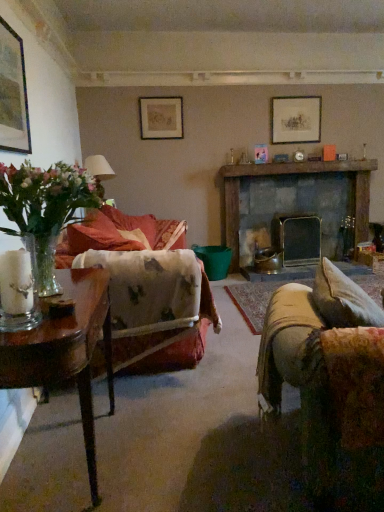
Question: Considering the relative sizes of clear glass vase at left and matte black picture frame at upper left, which is the third picture frame from back to front, in the image provided, is clear glass vase at left thinner than matte black picture frame at upper left, which is the third picture frame from back to front,?

Choices:
 (A) yes
 (B) no

Answer: (B)

Question: Can matte black picture frame at upper left, which is counted as the 3th picture frame, starting from the right, be found inside clear glass vase at left?

Choices:
 (A) no
 (B) yes

Answer: (A)

Question: From a real-world perspective, is clear glass vase at left on top of matte black picture frame at upper left, which is counted as the 3th picture frame, starting from the right?

Choices:
 (A) no
 (B) yes

Answer: (A)

Question: Can you confirm if clear glass vase at left is taller than matte black picture frame at upper left, which is counted as the 1th picture frame, starting from the front?

Choices:
 (A) no
 (B) yes

Answer: (A)

Question: Can you confirm if clear glass vase at left is shorter than matte black picture frame at upper left, which is counted as the 3th picture frame, starting from the right?

Choices:
 (A) no
 (B) yes

Answer: (B)

Question: Considering the relative positions of wooden table at left and matte silver picture frame at upper center, acting as the 3th picture frame starting from the front, in the image provided, is wooden table at left to the left or to the right of matte silver picture frame at upper center, acting as the 3th picture frame starting from the front,?

Choices:
 (A) left
 (B) right

Answer: (A)

Question: Considering the positions of wooden table at left and matte silver picture frame at upper center, acting as the 1th picture frame starting from the back, in the image, is wooden table at left taller or shorter than matte silver picture frame at upper center, acting as the 1th picture frame starting from the back,?

Choices:
 (A) tall
 (B) short

Answer: (A)

Question: Considering the positions of wooden table at left and matte silver picture frame at upper center, acting as the 1th picture frame starting from the back, in the image, is wooden table at left wider or thinner than matte silver picture frame at upper center, acting as the 1th picture frame starting from the back,?

Choices:
 (A) wide
 (B) thin

Answer: (A)

Question: Is wooden table at left bigger or smaller than matte silver picture frame at upper center, acting as the 1th picture frame starting from the back?

Choices:
 (A) big
 (B) small

Answer: (A)

Question: Choose the correct answer: Is dark gray stone fireplace at center inside rustic wooden mantle at upper center or outside it?

Choices:
 (A) inside
 (B) outside

Answer: (B)

Question: Considering the relative positions of dark gray stone fireplace at center and rustic wooden mantle at upper center in the image provided, is dark gray stone fireplace at center to the left or to the right of rustic wooden mantle at upper center?

Choices:
 (A) left
 (B) right

Answer: (B)

Question: From a real-world perspective, is dark gray stone fireplace at center above or below rustic wooden mantle at upper center?

Choices:
 (A) below
 (B) above

Answer: (A)

Question: Relative to rustic wooden mantle at upper center, is dark gray stone fireplace at center in front or behind?

Choices:
 (A) front
 (B) behind

Answer: (B)

Question: In the image, is dark gray stone fireplace at center positioned in front of or behind matte silver picture frame at upper center, which is the 1th picture frame in right-to-left order?

Choices:
 (A) behind
 (B) front

Answer: (B)

Question: Looking at their shapes, would you say dark gray stone fireplace at center is wider or thinner than matte silver picture frame at upper center, marked as the 3th picture frame in a left-to-right arrangement?

Choices:
 (A) wide
 (B) thin

Answer: (A)